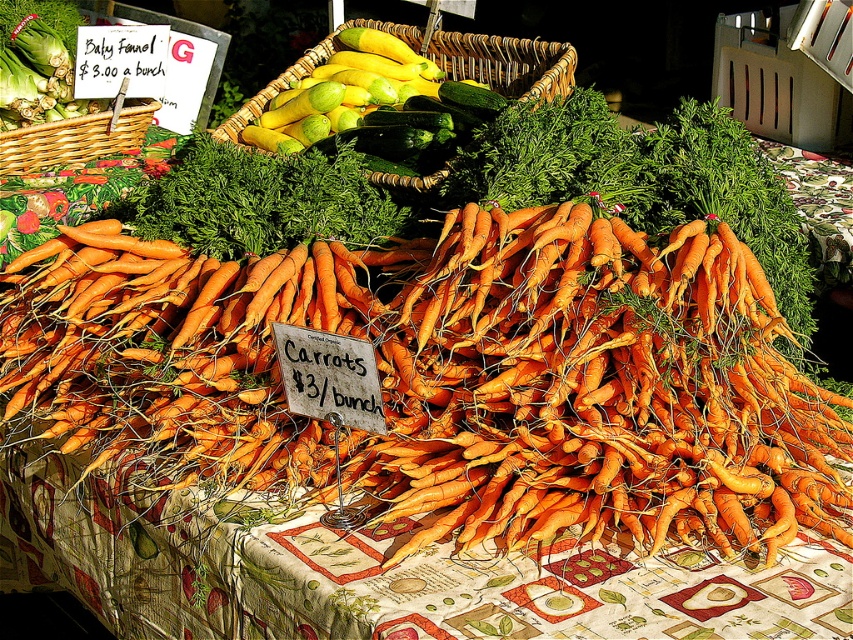
You are setting up a display at the farmer market. You have a green leafy at center and a woven brown basket at left. Which one has a wider base for placing items on top?

The green leafy at center has a wider base than the woven brown basket at left, so it can support items placed on top more stably.

You are at a farmer market and want to buy both the orange matte carrots at center and the green leafy at center. If you want to place them in a basket such that the taller item is on the bottom, which one should you put first?

The orange matte carrots at center has a greater height compared to green leafy at center, so you should place the orange matte carrots at center first on the bottom of the basket.